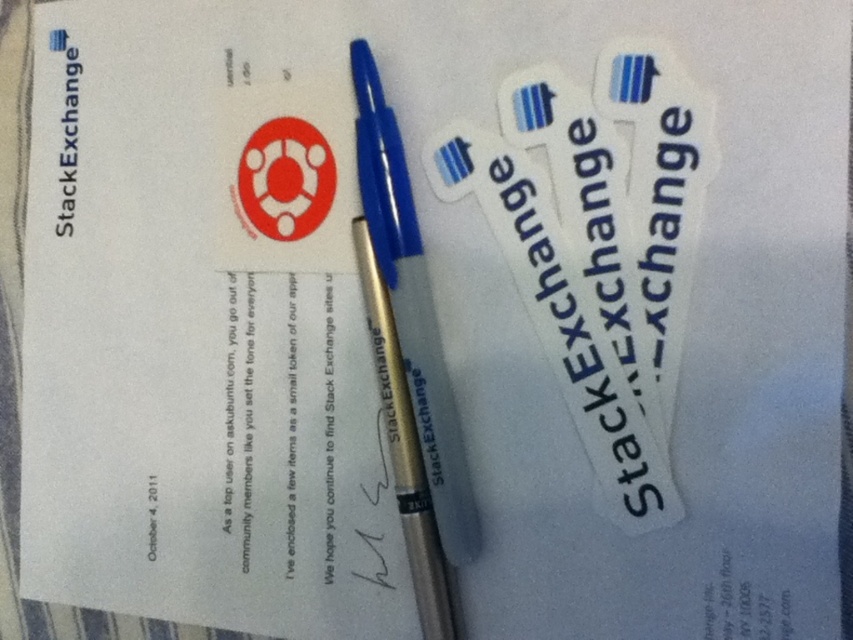
Question: Does white paper stickers at upper right have a greater width compared to gold metallic fountain pen at center?

Choices:
 (A) yes
 (B) no

Answer: (A)

Question: Does white paper stickers at upper right have a lesser width compared to gold metallic fountain pen at center?

Choices:
 (A) no
 (B) yes

Answer: (A)

Question: Based on their relative distances, which object is nearer to the metallic gold pen at center?

Choices:
 (A) gold metallic fountain pen at center
 (B) white paper stickers at upper right

Answer: (A)

Question: Does white paper stickers at upper right appear on the right side of metallic gold pen at center?

Choices:
 (A) no
 (B) yes

Answer: (B)

Question: Which point is closer to the camera?

Choices:
 (A) (437, 170)
 (B) (418, 326)

Answer: (B)

Question: Among these points, which one is farthest from the camera?

Choices:
 (A) (387, 403)
 (B) (595, 342)

Answer: (A)